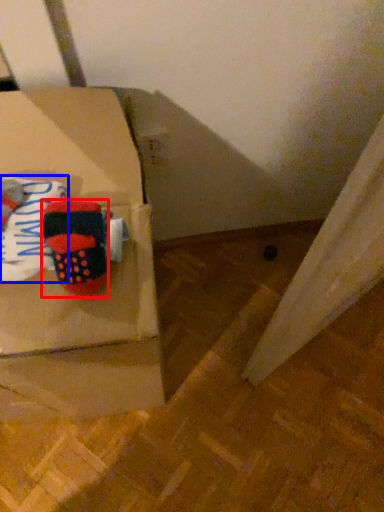
Question: Which object appears farthest to the camera in this image, footwear (highlighted by a red box) or clothing (highlighted by a blue box)?

Choices:
 (A) footwear
 (B) clothing

Answer: (A)